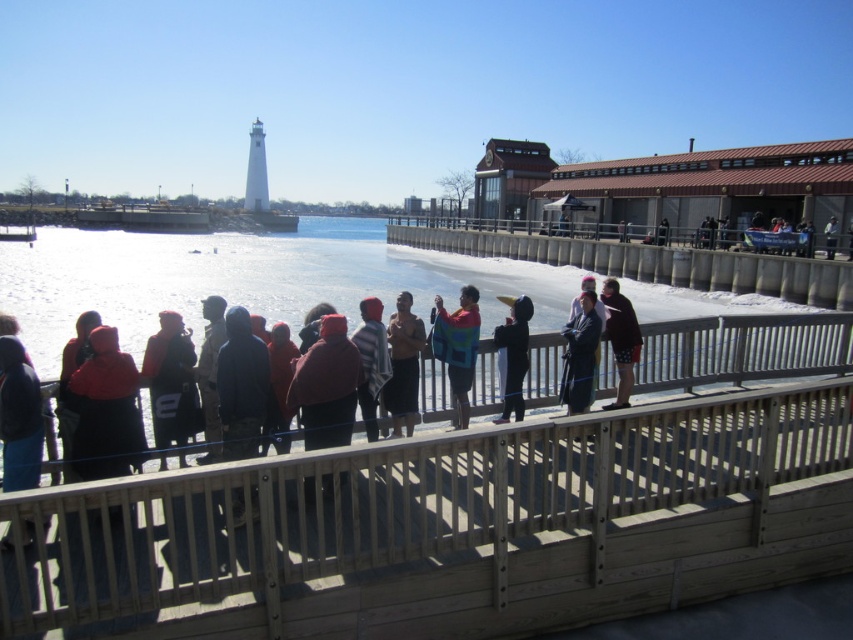
What are the coordinates of the shiny metallic tank top at center?

The shiny metallic tank top at center is located at coordinates 0.572 and 0.474.

You are a photographer trying to capture the knitted multicolored sweater at center and the dark blue fabric at center in a single shot. Based on their positions, which one would appear closer to the camera in the photo?

The knitted multicolored sweater at center appears closer to the camera because it is positioned below the dark blue fabric at center, indicating it is in a lower plane relative to the camera.

You are a photographer trying to capture a closeup of the shiny metallic tank top at center and dark gray jacket at center. Since you want both items to be clearly visible in the frame, which one should you zoom in on more to ensure the smaller item is as detailed as the larger one?

The shiny metallic tank top at center has a lesser width compared to dark gray jacket at center, so you should zoom in more on the shiny metallic tank top at center to make it as detailed as the dark gray jacket at center.